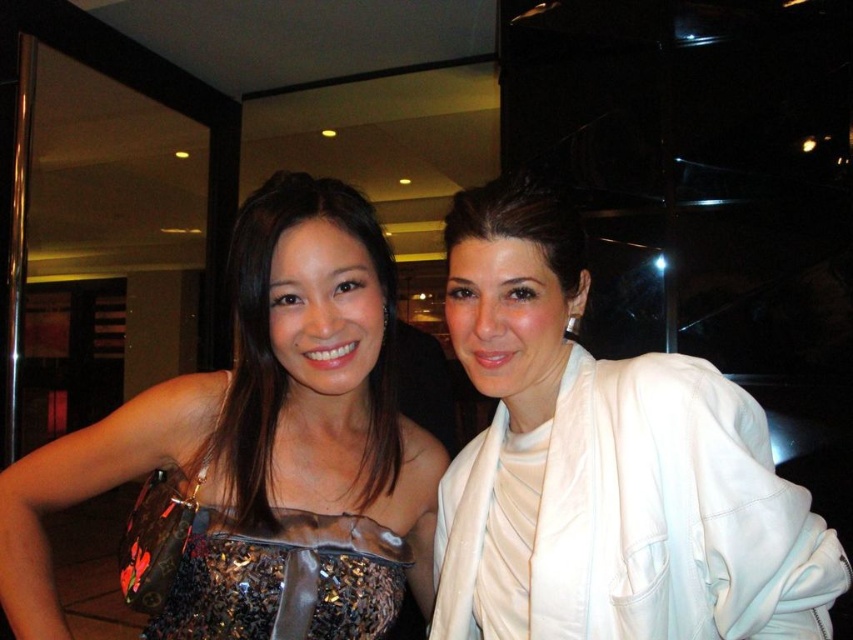
Describe the element at coordinates (260, 435) in the screenshot. This screenshot has width=853, height=640. I see `sequined fabric dress at center` at that location.

Can you confirm if sequined fabric dress at center is smaller than sparkly sequined dress at lower left?

Actually, sequined fabric dress at center might be larger than sparkly sequined dress at lower left.

Who is more forward, (x=292, y=182) or (x=352, y=602)?

Point (x=292, y=182) is more forward.

Identify the location of sequined fabric dress at center. This screenshot has height=640, width=853. (260, 435).

Does point (270, 588) lie in front of point (242, 440)?

Yes, it is.

Between sparkly sequined dress at lower left and shiny sequined dress at center, which one has more height?

shiny sequined dress at center is taller.

Image resolution: width=853 pixels, height=640 pixels. Find the location of `sparkly sequined dress at lower left`. sparkly sequined dress at lower left is located at coordinates (283, 579).

Between point (729, 520) and point (283, 572), which one is positioned in front?

Positioned in front is point (729, 520).

Who is more forward, (x=834, y=595) or (x=254, y=573)?

Point (x=834, y=595)

You are a GUI agent. You are given a task and a screenshot of the screen. Output one action in this format:
    pyautogui.click(x=<x>, y=<y>)
    Task: Click on the white satin robe at right
    This screenshot has height=640, width=853.
    Given the screenshot: What is the action you would take?
    pyautogui.click(x=672, y=513)